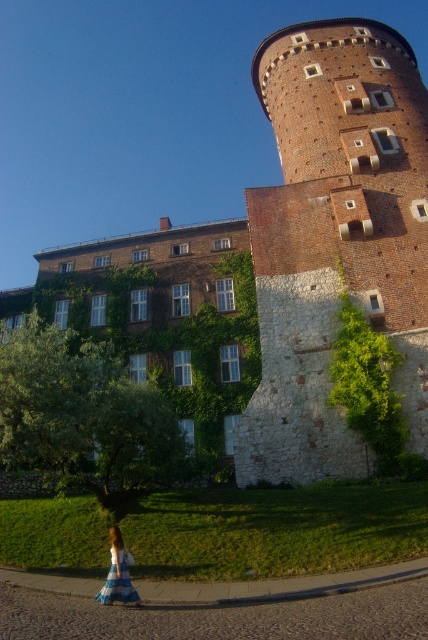
You are standing at the entrance of the historic building and want to take a photo of the brown brick tower at center. If you move 0.1 units to the left along the x axis and 0.05 units down along the y axis from your current position, will you be closer to the tower?

The 2D location of brown brick tower at center is at point (x=335, y=237). Moving 0.1 units left on the x axis and 0.05 units down on the y axis would adjust your position, but without knowing your starting coordinates, it is impossible to determine if you are closer to the tower.